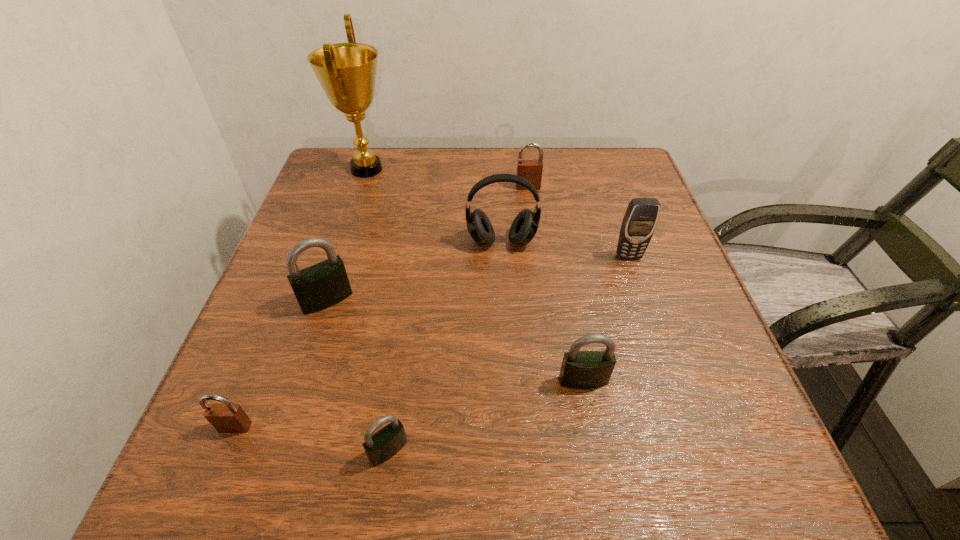
The width and height of the screenshot is (960, 540). I want to click on the nearest padlock, so click(x=384, y=444).

Where is `the second black padlock from right to left`? the second black padlock from right to left is located at coordinates (384, 444).

Locate an element on the screen. The width and height of the screenshot is (960, 540). the nearer brown padlock is located at coordinates (226, 418).

Locate an element on the screen. The width and height of the screenshot is (960, 540). the smaller brown padlock is located at coordinates (226, 418).

You are a GUI agent. You are given a task and a screenshot of the screen. Output one action in this format:
    pyautogui.click(x=<x>, y=<y>)
    Task: Click on the free space located 0.250m on the front view with handles of the tallest object
    
    Given the screenshot: What is the action you would take?
    pyautogui.click(x=492, y=169)

I want to click on vacant space located on the ear cups of the black headset, so click(x=507, y=335).

In order to click on free spot located on the back of the second padlock from left to right in this screenshot , I will do `click(356, 208)`.

Identify the location of free location located 0.250m on the front face of the cellular telephone. point(665,366).

Locate an element on the screen. vacant space situated on the front-facing side of the bigger brown padlock is located at coordinates (544, 314).

I want to click on blank space located on the left of the third nearest padlock, so click(x=454, y=381).